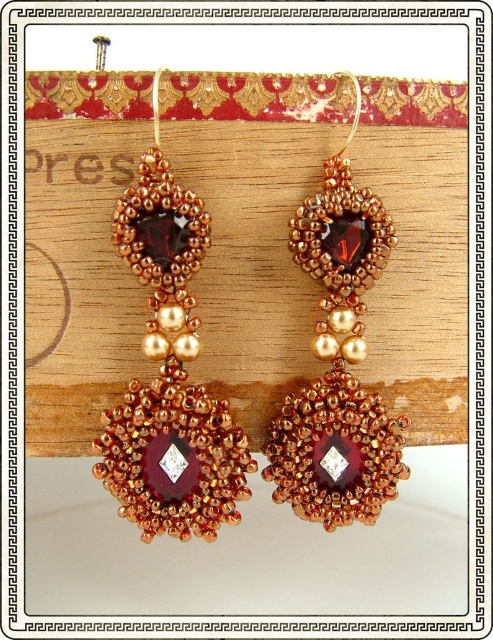
Question: Observing the image, what is the correct spatial positioning of matte gold earrings at center in reference to copper beaded earring at center?

Choices:
 (A) below
 (B) above

Answer: (A)

Question: Is matte gold earrings at center smaller than copper beaded earring at center?

Choices:
 (A) no
 (B) yes

Answer: (A)

Question: Does matte gold earrings at center have a larger size compared to copper beaded earring at center?

Choices:
 (A) no
 (B) yes

Answer: (B)